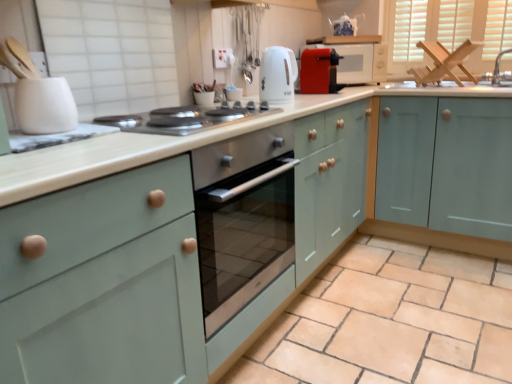
Identify the location of free point above matte gray tile at center (from a real-world perspective). (385, 289).